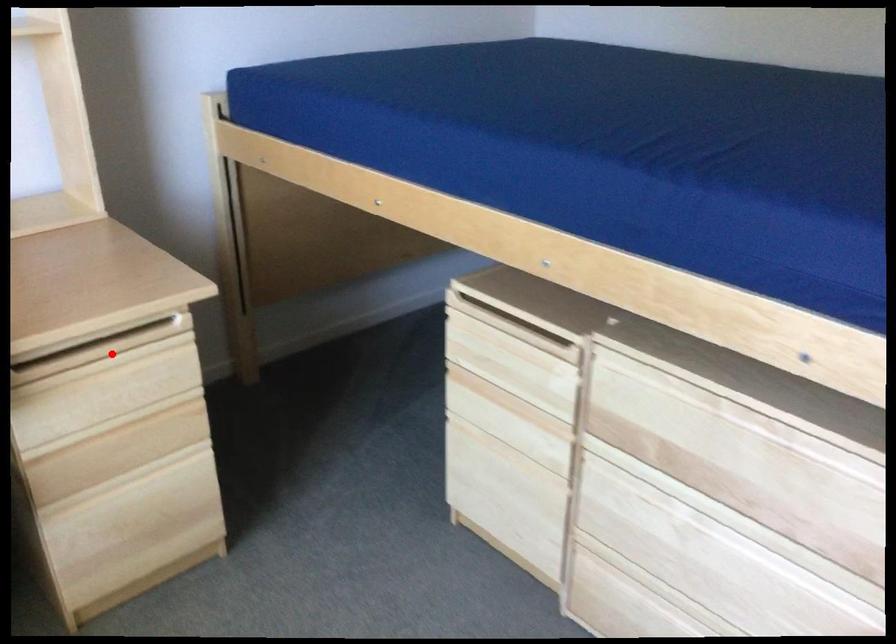
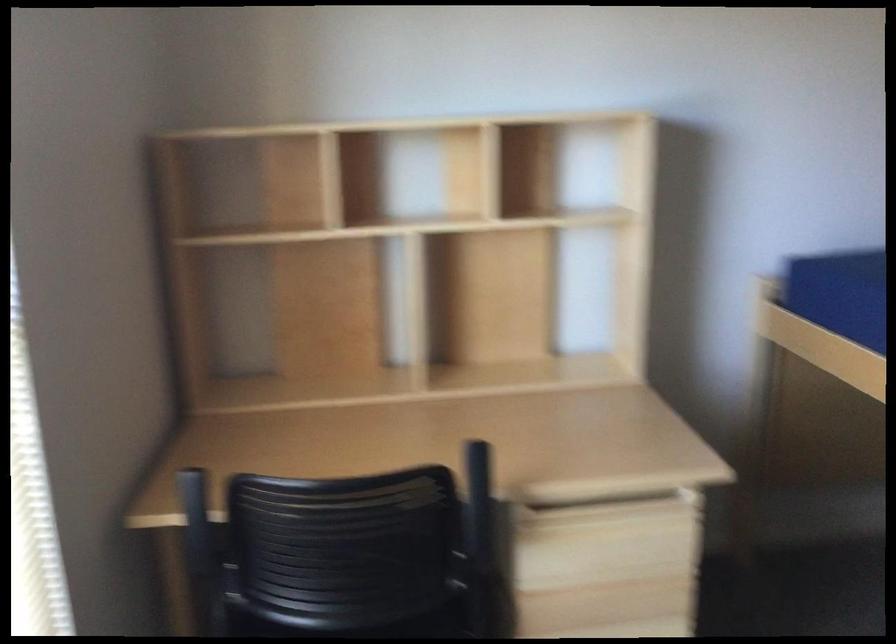
Find the pixel in the second image that matches the highlighted location in the first image.

(616, 520)